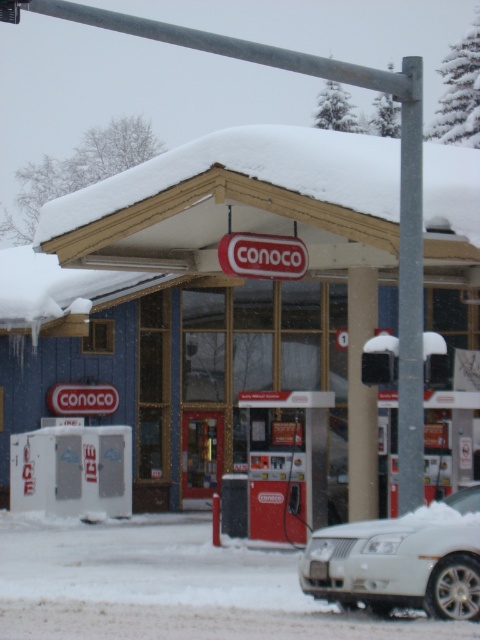
Does matte blue gas station at center appear on the right side of white matte car at lower right?

Incorrect, matte blue gas station at center is not on the right side of white matte car at lower right.

Which is more to the right, matte blue gas station at center or white matte car at lower right?

white matte car at lower right is more to the right.

Who is more forward, (310, 216) or (358, 525)?

Point (358, 525) is in front.

The height and width of the screenshot is (640, 480). Identify the location of matte blue gas station at center. (205, 296).